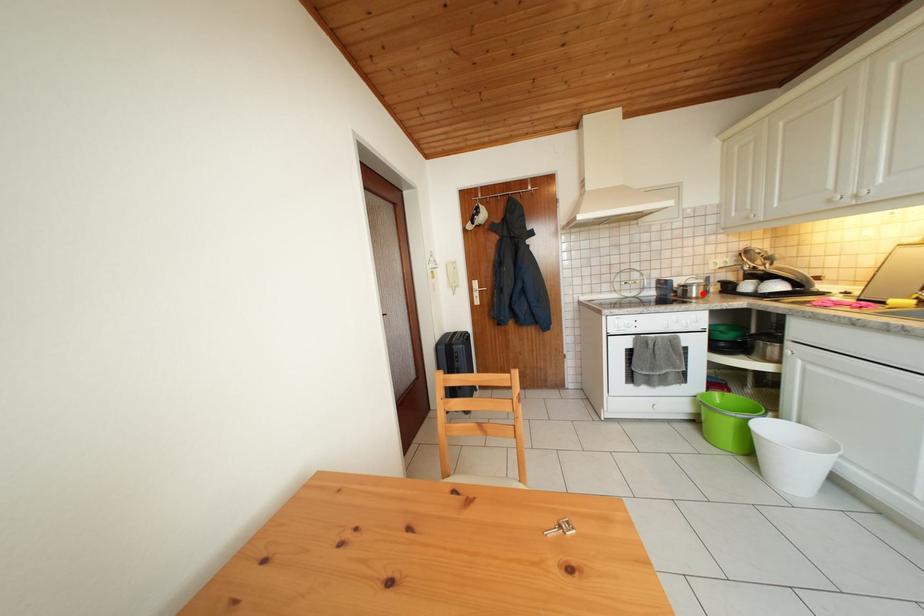
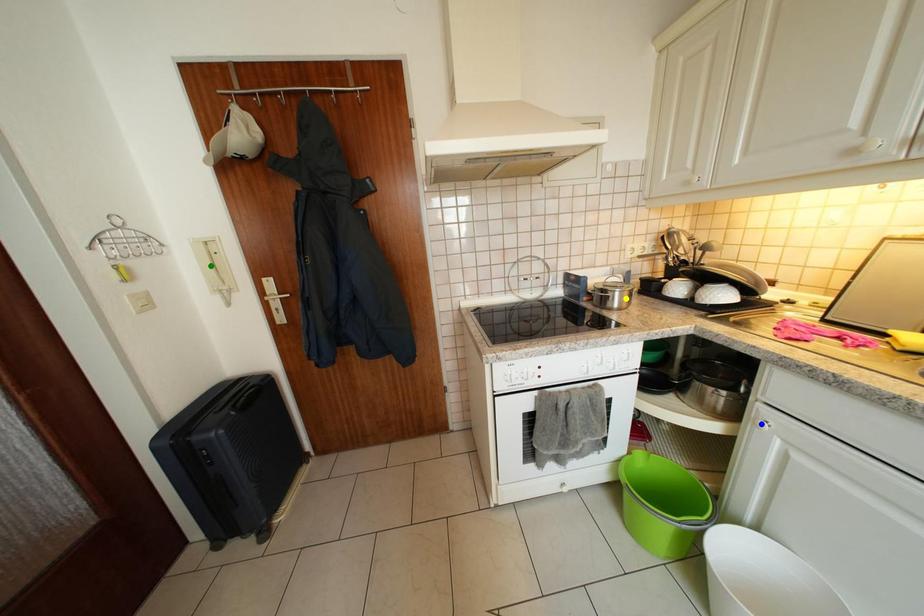
Question: I am providing you with two images of the same scene from different viewpoints. A red point is marked on the first image. You are given multiple points on the second image. Can you choose the point in image 2 that corresponds to the point in image 1?

Choices:
 (A) blue point
 (B) yellow point
 (C) green point

Answer: (B)